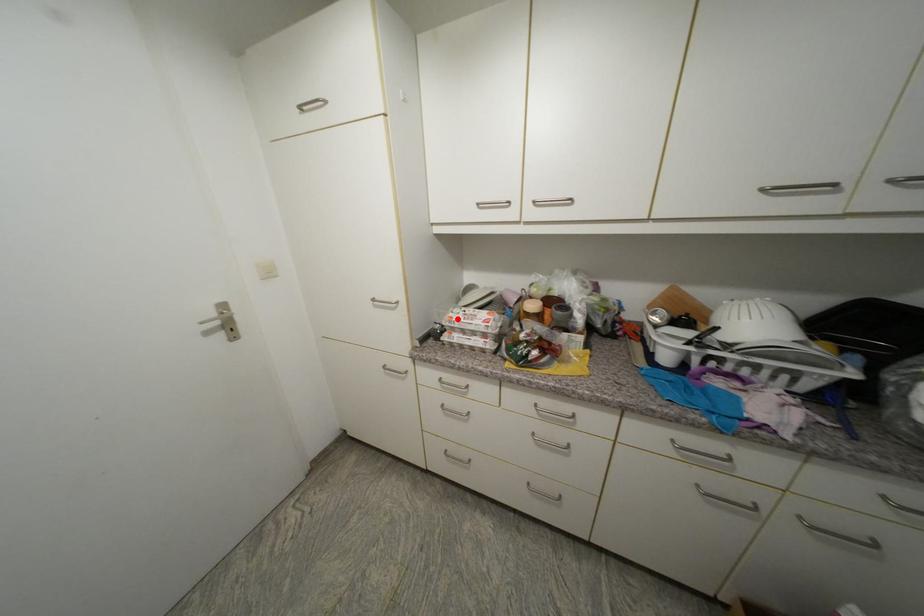
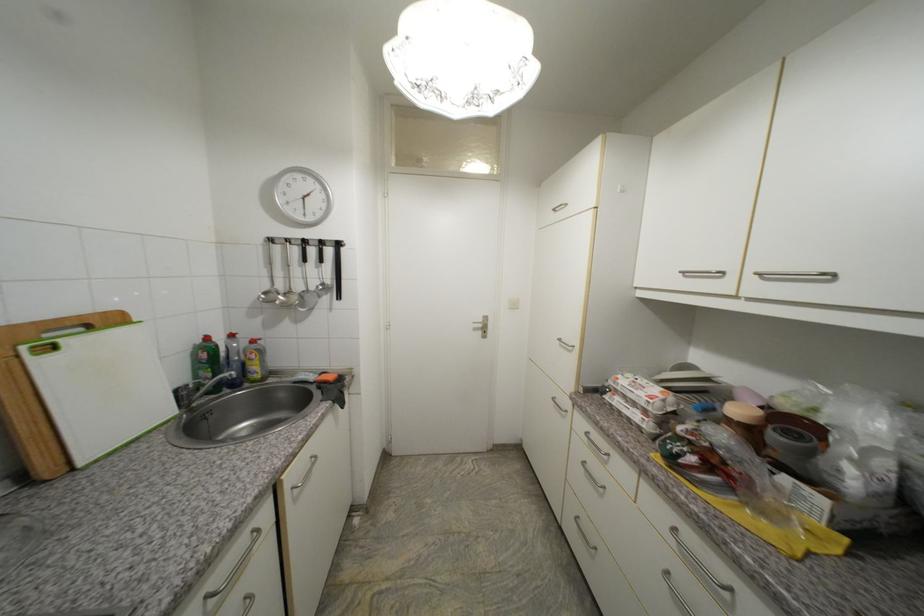
Where in the second image is the point corresponding to the highlighted location from the first image?

(623, 379)